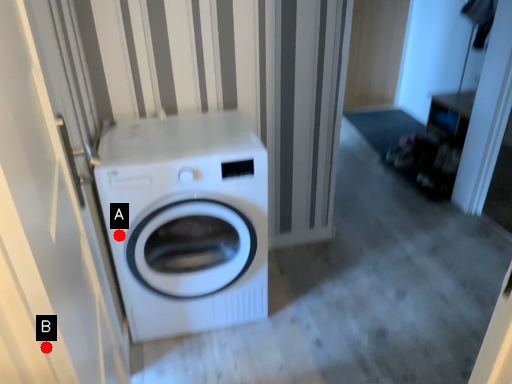
Question: Two points are circled on the image, labeled by A and B beside each circle. Which point appears closest to the camera in this image?

Choices:
 (A) A is closer
 (B) B is closer

Answer: (B)